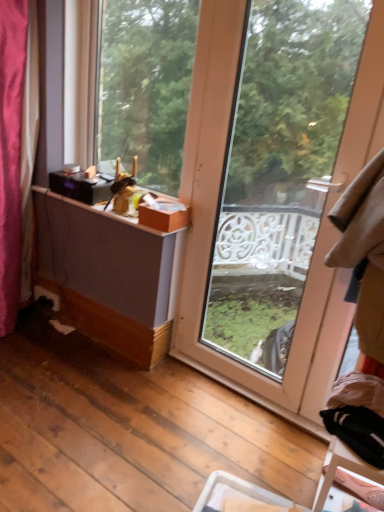
The width and height of the screenshot is (384, 512). I want to click on empty space that is ontop of orange cardboard box at upper center (from a real-world perspective), so click(x=172, y=202).